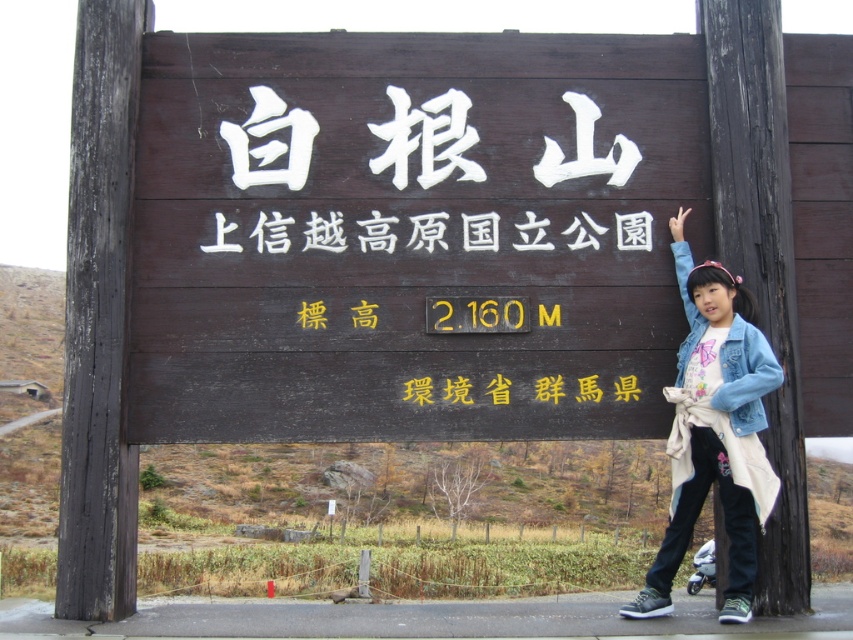
You are standing in front of the White Root Mountain signboard. You see a dark wood post at right and a white wood sign at center. Which object is located to the right of the other?

The dark wood post at right is located to the right of the white wood sign at center.

You are a hiker standing at the entrance of the park and see the dark wood sign at center and the white wood sign at center. Which one is positioned to the left?

The dark wood sign at center is positioned to the left of the white wood sign at center.

You are standing in front of the White Root Mountain signboard and want to touch both points on it. Which point should you reach for first, the point at coordinates point (463, 268) or point (407, 234)?

You should reach for point (407, 234) first because it is closer to you than point (463, 268), which is further away.